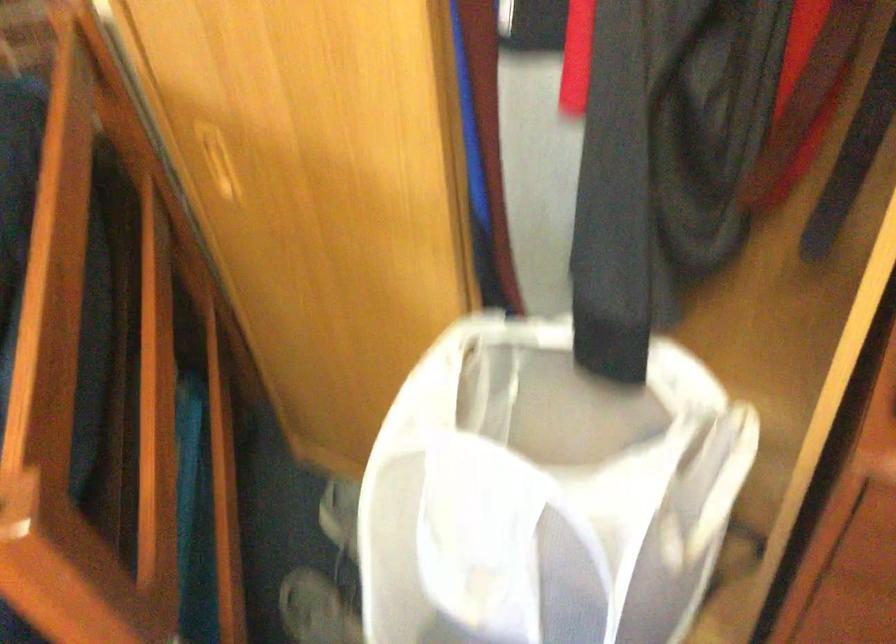
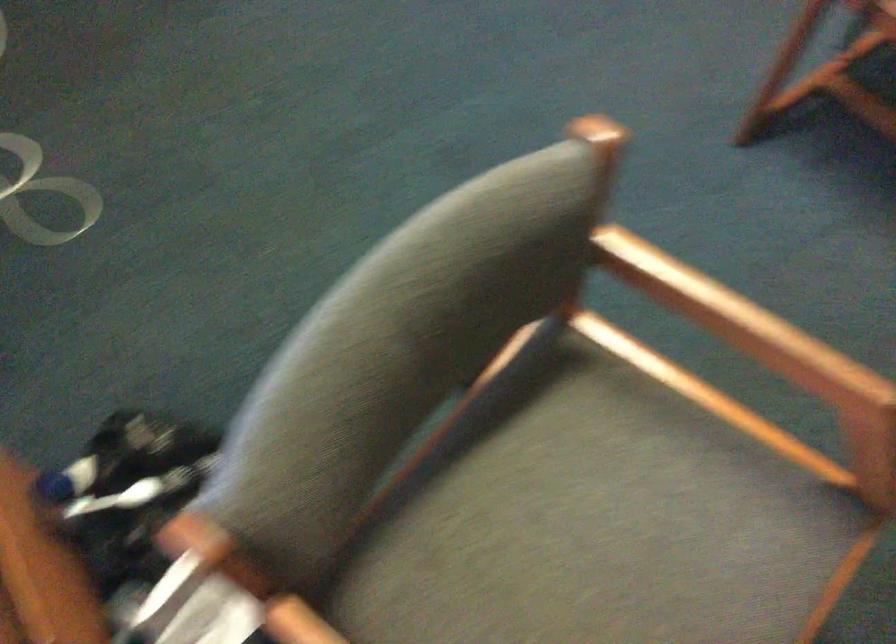
In a continuous first-person perspective shot, in which direction is the camera moving?

The cameraman moved toward left, backward.